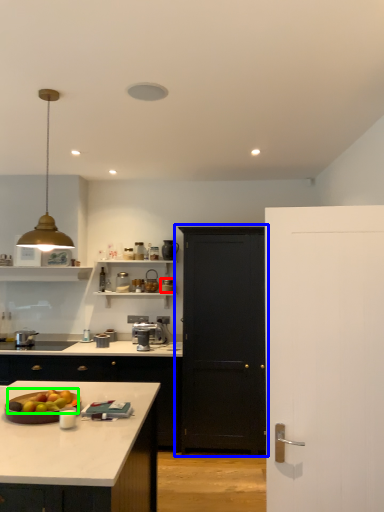
Question: Which object is the farthest from appliance (highlighted by a red box)? Choose among these: door (highlighted by a blue box) or apple (highlighted by a green box).

Choices:
 (A) door
 (B) apple

Answer: (B)